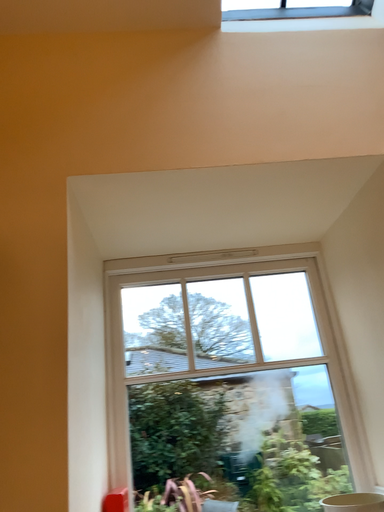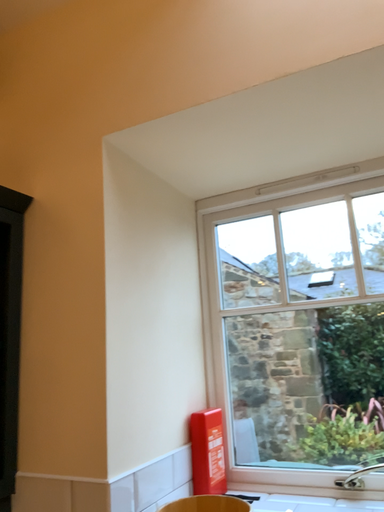
Question: Which way did the camera rotate in the video?

Choices:
 (A) rotated right
 (B) rotated left

Answer: (B)